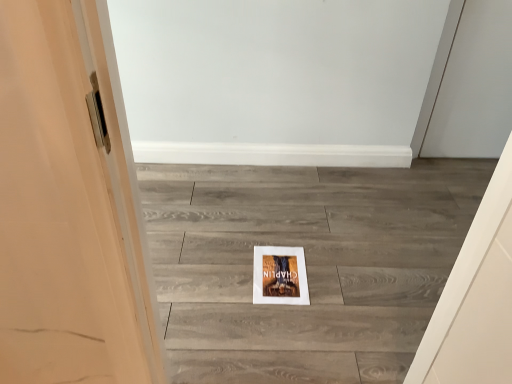
Measure the distance between point (283, 275) and camera.

Point (283, 275) and camera are 5.48 feet apart.

Find the location of a particular element. Image resolution: width=512 pixels, height=384 pixels. matte paper flyer at center is located at coordinates [279, 276].

What do you see at coordinates (279, 276) in the screenshot? The width and height of the screenshot is (512, 384). I see `matte paper flyer at center` at bounding box center [279, 276].

In order to face matte paper flyer at center, should I rotate leftwards or rightwards?

You should look right and rotate roughly 3.452 degrees.

Locate an element on the screen. matte paper flyer at center is located at coordinates (279, 276).